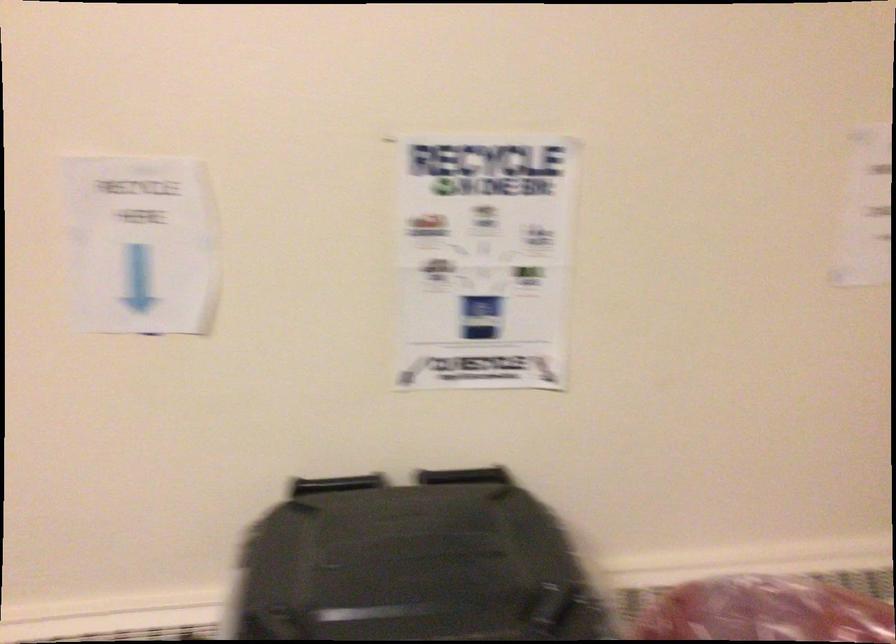
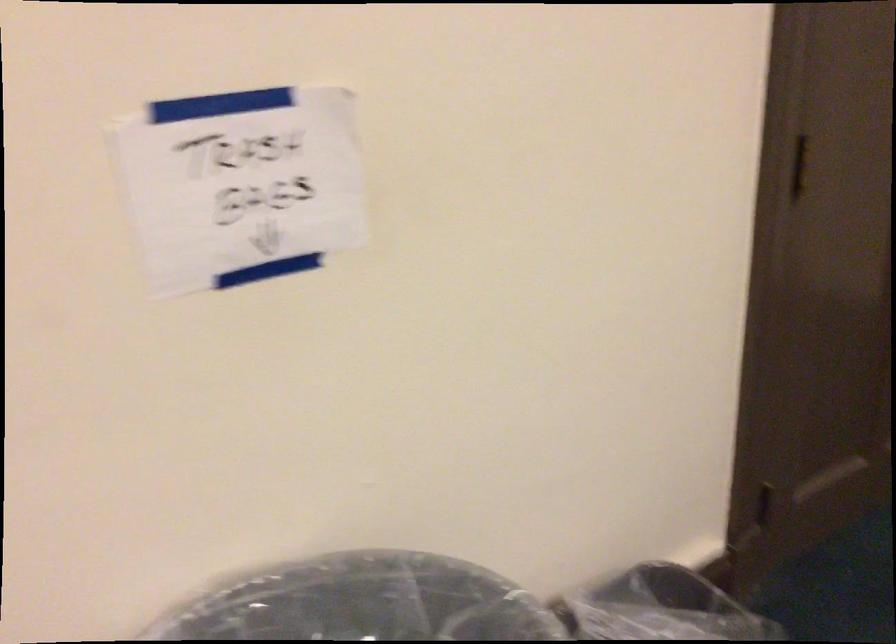
The first image is from the beginning of the video and the second image is from the end. How did the camera likely rotate when shooting the video?

The camera rotated toward right-down.